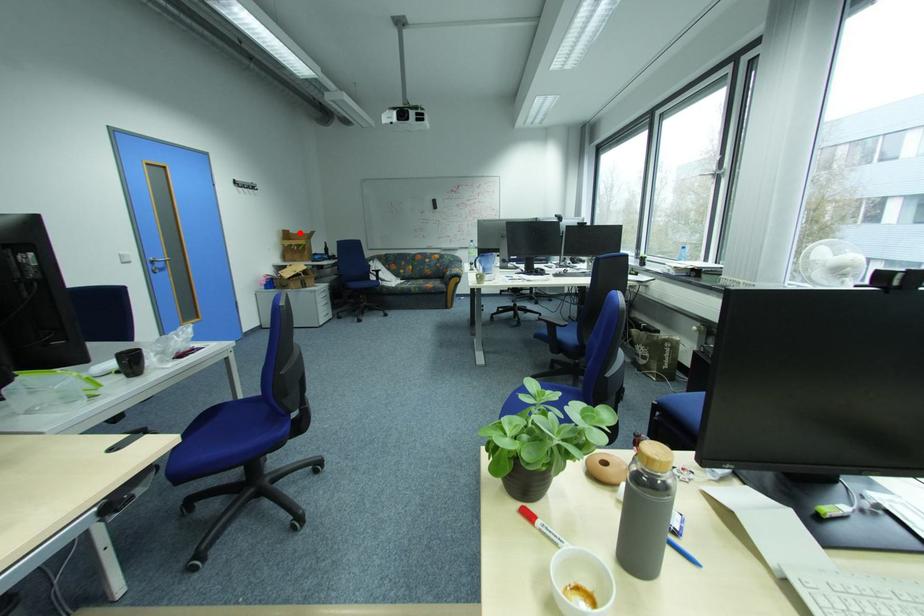
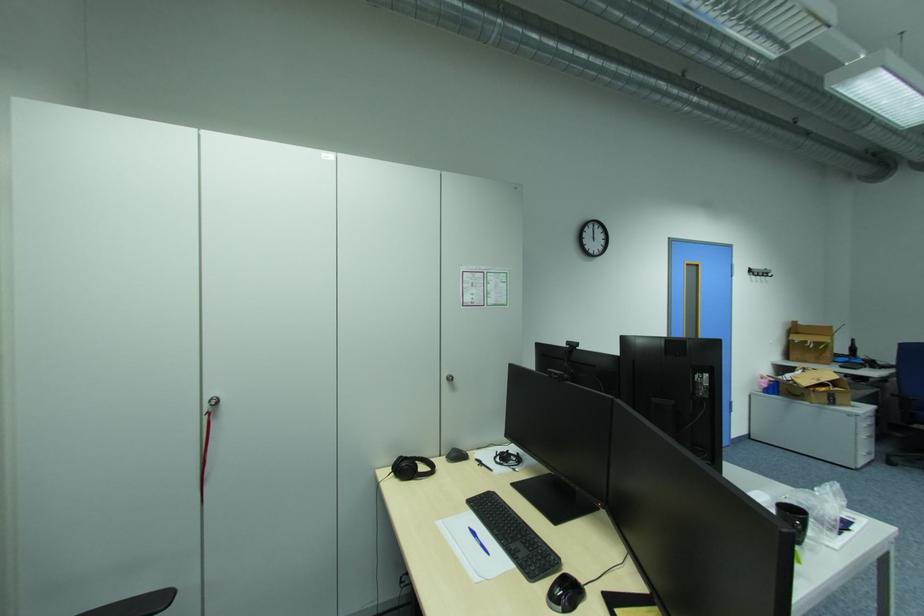
Where in the second image is the point corresponding to the highlighted location from the first image?

(808, 323)